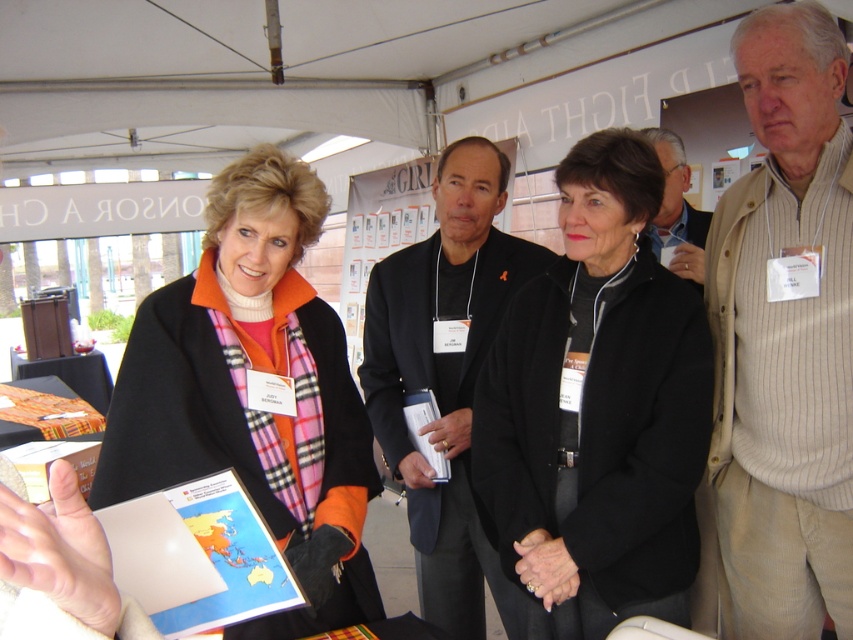
Which is in front, point (822, 484) or point (184, 298)?

Point (184, 298)

This screenshot has height=640, width=853. I want to click on beige striped shirt at center, so click(785, 339).

Find the location of a particular element. beige striped shirt at center is located at coordinates (785, 339).

Locate an element on the screen. beige striped shirt at center is located at coordinates (785, 339).

Is point (245, 349) closer to camera compared to point (369, 371)?

Yes, point (245, 349) is in front of point (369, 371).

Between orange wool scarf at center and black suit at center, which one is positioned lower?

black suit at center is below.

The image size is (853, 640). Find the location of `orange wool scarf at center`. orange wool scarf at center is located at coordinates (250, 396).

Image resolution: width=853 pixels, height=640 pixels. I want to click on orange wool scarf at center, so click(250, 396).

Does black matte jacket at center appear on the left side of orange wool scarf at center?

In fact, black matte jacket at center is to the right of orange wool scarf at center.

Measure the distance from black matte jacket at center to orange wool scarf at center.

A distance of 20.20 inches exists between black matte jacket at center and orange wool scarf at center.

What do you see at coordinates (598, 408) in the screenshot? The height and width of the screenshot is (640, 853). I see `black matte jacket at center` at bounding box center [598, 408].

Locate an element on the screen. The image size is (853, 640). black matte jacket at center is located at coordinates (598, 408).